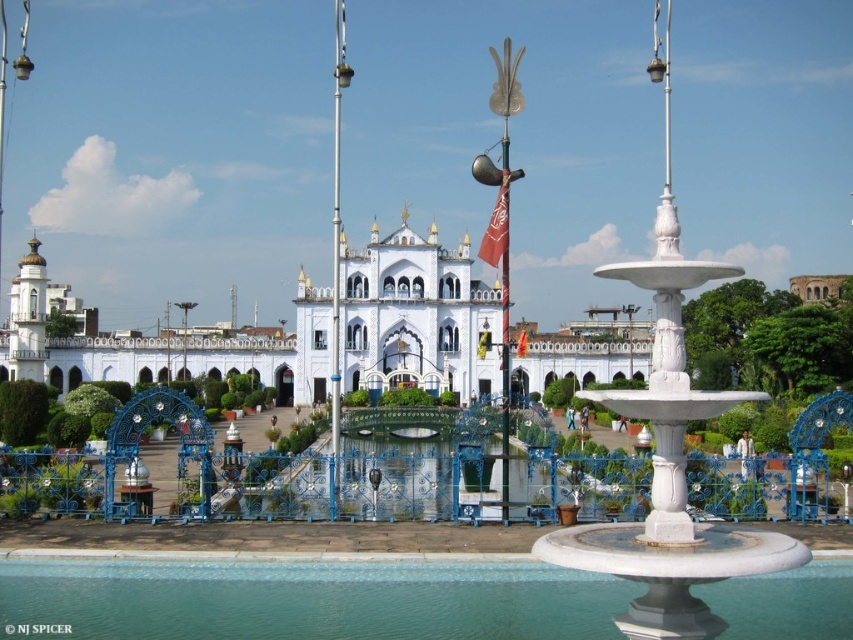
Question: Which point is farther to the camera?

Choices:
 (A) (561, 348)
 (B) (502, 570)
 (C) (714, 269)

Answer: (A)

Question: Is clear glass pool at center below white marble fountain at center?

Choices:
 (A) yes
 (B) no

Answer: (A)

Question: Is white marble palace at center to the right of white marble fountain at center from the viewer's perspective?

Choices:
 (A) yes
 (B) no

Answer: (B)

Question: Is white marble palace at center wider than white marble fountain at center?

Choices:
 (A) yes
 (B) no

Answer: (A)

Question: Estimate the real-world distances between objects in this image. Which object is closer to the white marble fountain at center?

Choices:
 (A) white marble palace at center
 (B) clear glass pool at center

Answer: (B)

Question: Which point is farther from the camera taking this photo?

Choices:
 (A) (563, 595)
 (B) (38, 272)

Answer: (B)